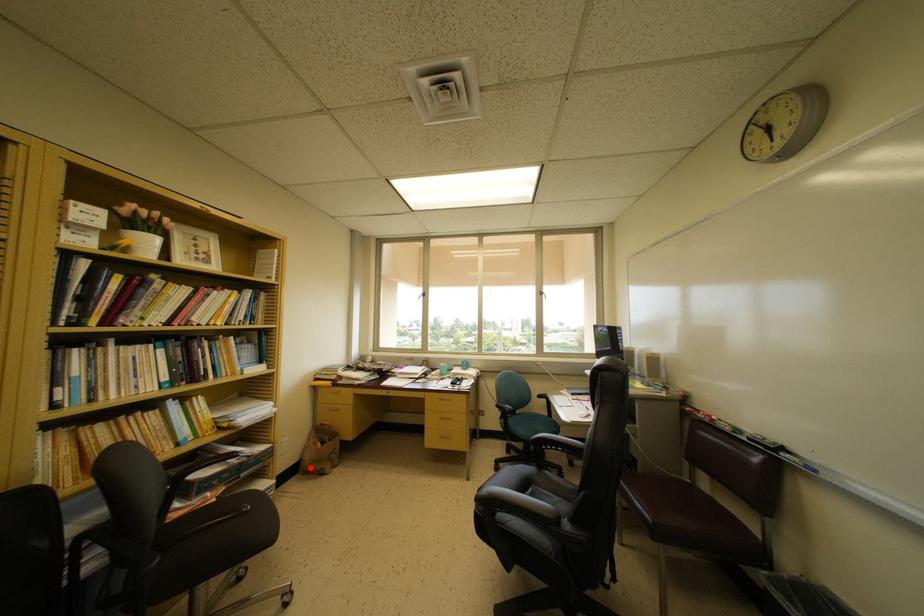
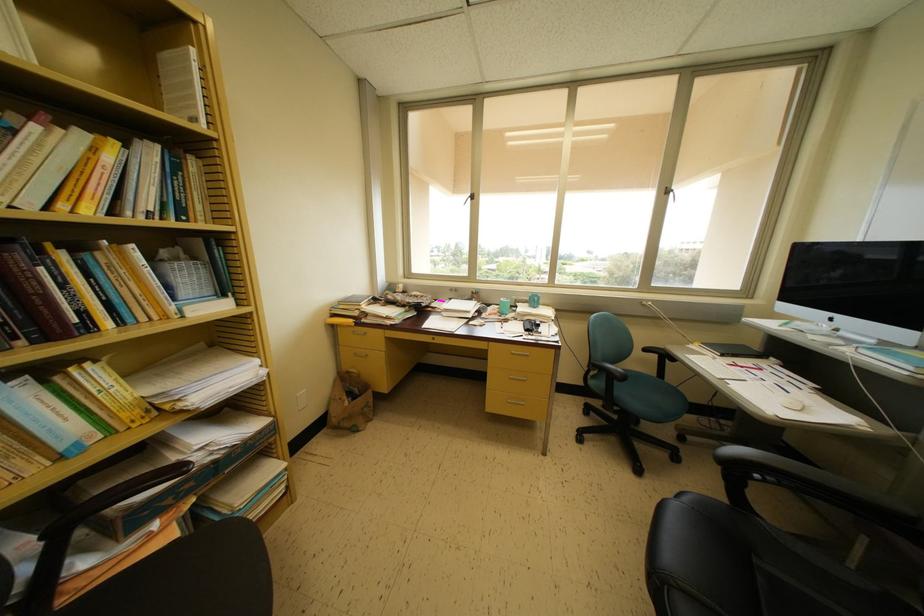
In the second image, find the point that corresponds to the highlighted location in the first image.

(337, 424)